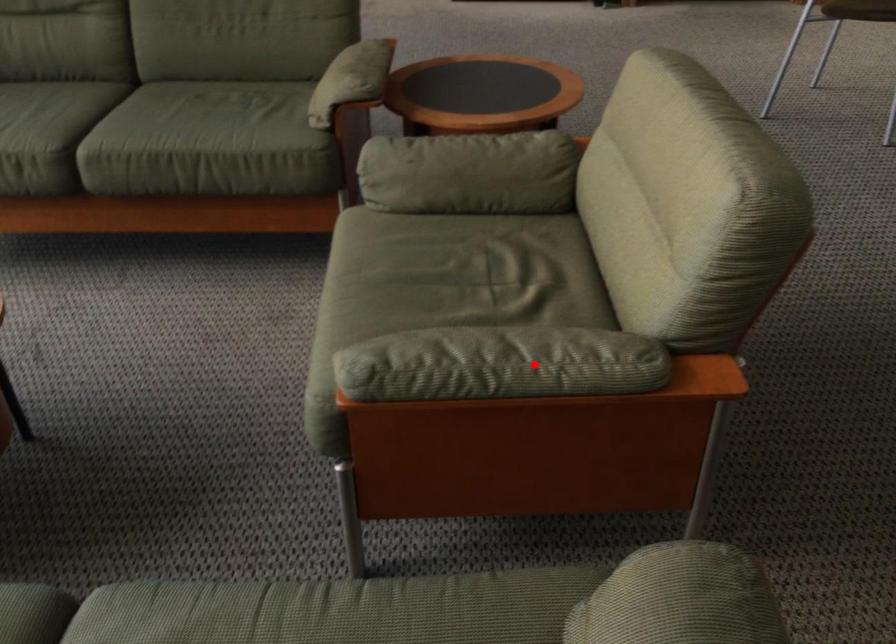
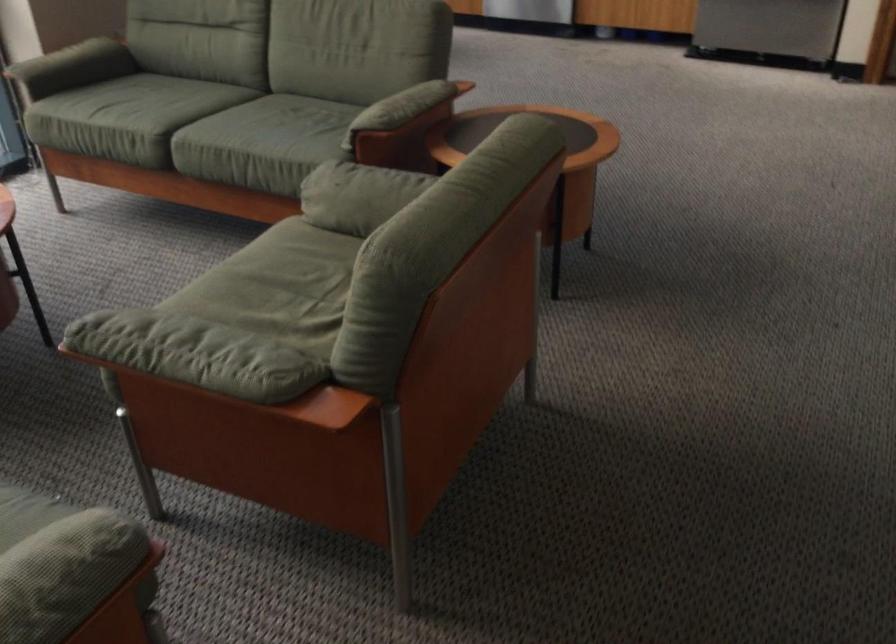
Question: I am providing you with two images of the same scene from different viewpoints. Image1 has a red point marked. In image2, the corresponding 3D location appears at what relative position? Reply with the corresponding letter.

Choices:
 (A) Closer
 (B) Farther

Answer: (B)